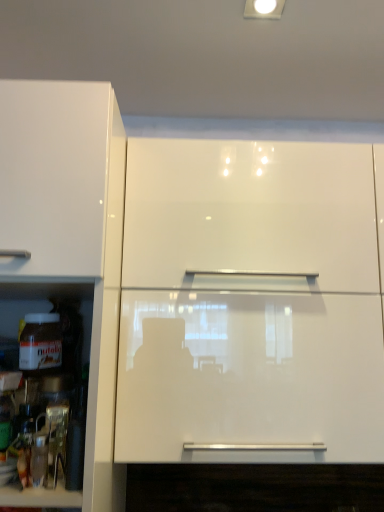
Describe the element at coordinates (250, 376) in the screenshot. I see `glossy white cabinet at upper center` at that location.

In order to face glossy white cabinet at upper center, should I rotate leftwards or rightwards?

Rotate right and turn 11.436 degrees.

Where is `glossy white cabinet at upper center`? glossy white cabinet at upper center is located at coordinates (250, 376).

What do you see at coordinates (70, 231) in the screenshot? I see `white glossy cabinet at left` at bounding box center [70, 231].

What is the approximate height of white glossy cabinet at left?

white glossy cabinet at left is 3.50 feet tall.

Find the location of `white glossy cabinet at left`. white glossy cabinet at left is located at coordinates (70, 231).

At what (x,y) coordinates should I click in order to perform the action: click on glossy white cabinet at upper center. Please return your answer as a coordinate pair (x, y). Image resolution: width=384 pixels, height=512 pixels. Looking at the image, I should click on [250, 376].

Considering the relative positions of white glossy cabinet at left and glossy white cabinet at upper center in the image provided, is white glossy cabinet at left to the left of glossy white cabinet at upper center from the viewer's perspective?

Correct, you'll find white glossy cabinet at left to the left of glossy white cabinet at upper center.

Is the depth of white glossy cabinet at left less than that of glossy white cabinet at upper center?

That is True.

Is point (93, 106) closer to camera compared to point (250, 298)?

Yes, point (93, 106) is in front of point (250, 298).

From the image's perspective, is white glossy cabinet at left above or below glossy white cabinet at upper center?

white glossy cabinet at left is situated lower than glossy white cabinet at upper center in the image.

From a real-world perspective, is white glossy cabinet at left physically above glossy white cabinet at upper center?

No, from a real-world perspective, white glossy cabinet at left is not over glossy white cabinet at upper center

Does white glossy cabinet at left have a lesser width compared to glossy white cabinet at upper center?

In fact, white glossy cabinet at left might be wider than glossy white cabinet at upper center.

Does white glossy cabinet at left have a lesser height compared to glossy white cabinet at upper center?

No, white glossy cabinet at left is not shorter than glossy white cabinet at upper center.

Considering the relative sizes of white glossy cabinet at left and glossy white cabinet at upper center in the image provided, is white glossy cabinet at left smaller than glossy white cabinet at upper center?

No, white glossy cabinet at left is not smaller than glossy white cabinet at upper center.

Do you think white glossy cabinet at left is within glossy white cabinet at upper center, or outside of it?

white glossy cabinet at left lies outside glossy white cabinet at upper center.

Is white glossy cabinet at left beside glossy white cabinet at upper center?

No, white glossy cabinet at left is not making contact with glossy white cabinet at upper center.

Is white glossy cabinet at left looking in the opposite direction of glossy white cabinet at upper center?

white glossy cabinet at left is not turned away from glossy white cabinet at upper center.

Locate an element on the screen. This screenshot has height=512, width=384. glass door on the right of white glossy cabinet at left is located at coordinates (250, 376).

Considering the relative positions of glossy white cabinet at upper center and white glossy cabinet at left in the image provided, is glossy white cabinet at upper center to the left or to the right of white glossy cabinet at left?

From the image, it's evident that glossy white cabinet at upper center is to the right of white glossy cabinet at left.

Between glossy white cabinet at upper center and white glossy cabinet at left, which one is positioned in front?

white glossy cabinet at left is closer to the camera.

Between point (271, 366) and point (66, 201), which one is positioned behind?

The point (271, 366) is farther from the camera.

From the image's perspective, is glossy white cabinet at upper center located above white glossy cabinet at left?

Yes.

From a real-world perspective, which object rests below the other?

In real-world perspective, white glossy cabinet at left is lower.

Considering the sizes of glossy white cabinet at upper center and white glossy cabinet at left in the image, is glossy white cabinet at upper center wider or thinner than white glossy cabinet at left?

Considering their sizes, glossy white cabinet at upper center looks slimmer than white glossy cabinet at left.

Considering the sizes of objects glossy white cabinet at upper center and white glossy cabinet at left in the image provided, who is taller, glossy white cabinet at upper center or white glossy cabinet at left?

white glossy cabinet at left.

Considering the sizes of objects glossy white cabinet at upper center and white glossy cabinet at left in the image provided, who is bigger, glossy white cabinet at upper center or white glossy cabinet at left?

white glossy cabinet at left.

Is glossy white cabinet at upper center surrounding white glossy cabinet at left?

No, white glossy cabinet at left is not inside glossy white cabinet at upper center.

Would you consider glossy white cabinet at upper center to be distant from white glossy cabinet at left?

No, there isn't a large distance between glossy white cabinet at upper center and white glossy cabinet at left.

Is glossy white cabinet at upper center oriented towards white glossy cabinet at left?

No, glossy white cabinet at upper center is not turned towards white glossy cabinet at left.

How much distance is there between glossy white cabinet at upper center and white glossy cabinet at left?

glossy white cabinet at upper center and white glossy cabinet at left are 11.87 inches apart from each other.

This screenshot has height=512, width=384. In order to click on glass door above the white glossy cabinet at left (from the image's perspective) in this screenshot , I will do `click(250, 376)`.

You are a GUI agent. You are given a task and a screenshot of the screen. Output one action in this format:
    pyautogui.click(x=<x>, y=<y>)
    Task: Click on the glass door on the right of white glossy cabinet at left
    
    Given the screenshot: What is the action you would take?
    pyautogui.click(x=250, y=376)

This screenshot has height=512, width=384. I want to click on cabinetry that is under the glossy white cabinet at upper center (from a real-world perspective), so click(70, 231).